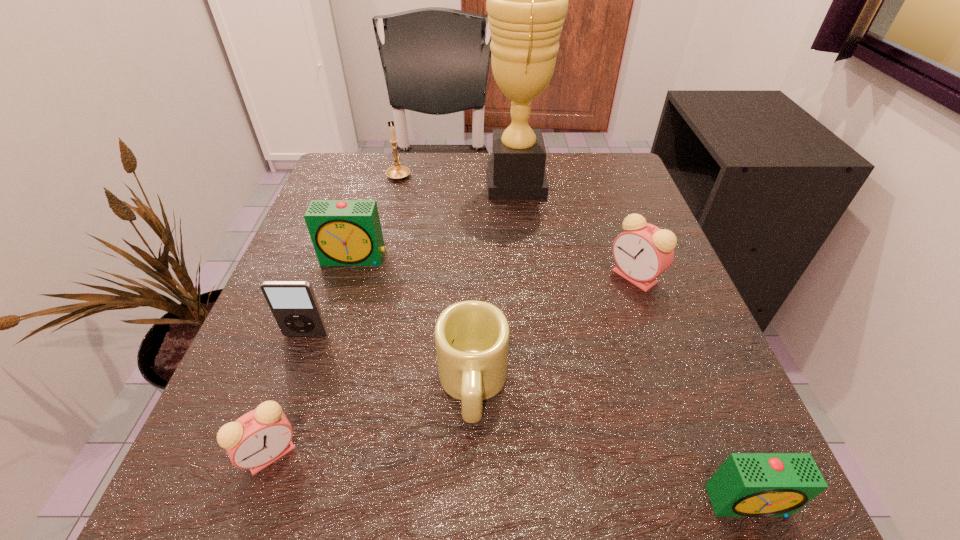
I want to click on vacant space that's between the nearer green alarm clock and the iPod, so click(527, 418).

Identify the location of vacant area between the gold candle holder and the nearer green alarm clock. (574, 338).

Locate an element on the screen. free spot between the tallest object and the bigger pink alarm clock is located at coordinates (575, 230).

The image size is (960, 540). What are the coordinates of `vacant area between the farther green alarm clock and the mug` in the screenshot? It's located at [414, 321].

This screenshot has width=960, height=540. What are the coordinates of `vacant area that lies between the third farthest alarm clock and the yellow trophy cup` in the screenshot? It's located at (394, 318).

Where is `the fifth closest object to the yellow trophy cup`? This screenshot has width=960, height=540. the fifth closest object to the yellow trophy cup is located at coordinates (293, 304).

Find the location of `object identified as the second closest to the beige mug`. object identified as the second closest to the beige mug is located at coordinates (293, 304).

Where is `alarm clock identified as the closest to the iPod`? The image size is (960, 540). alarm clock identified as the closest to the iPod is located at coordinates (258, 438).

Identify which alarm clock is located as the second nearest to the beige mug. Please provide its 2D coordinates. Your answer should be formatted as a tuple, i.e. [(x, y)], where the tuple contains the x and y coordinates of a point satisfying the conditions above.

[(344, 232)]

Image resolution: width=960 pixels, height=540 pixels. Identify the location of free spot that satisfies the following two spatial constraints: 1. at the front of the trophy cup with handles; 2. on the face of the nearer pink alarm clock. (545, 454).